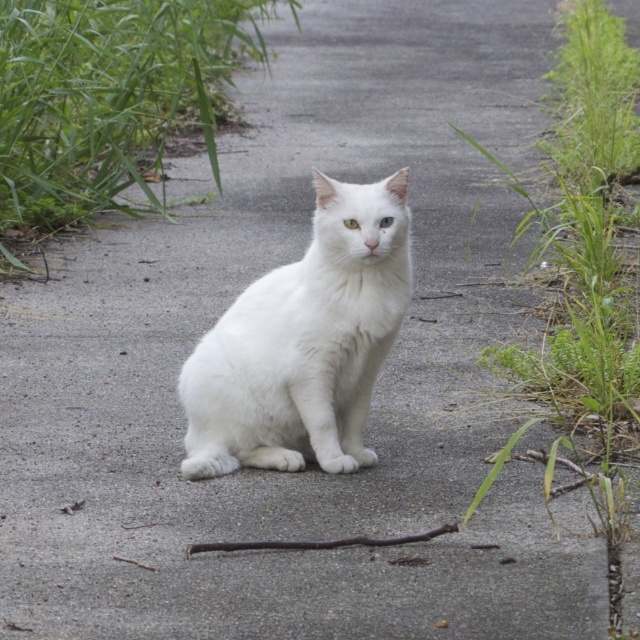
You are a photographer aiming to capture a clear shot of the white fluffy cat at center without any background distractions. Based on the scene, can you position yourself so that the green leafy grass at upper right is not visible in the background behind the cat?

The green leafy grass at upper right is behind the white fluffy cat at center, so positioning yourself so that the cat blocks the grass from view would hide the grass in the background. This can be achieved by framing the shot so the cat is centered and fills the frame enough to cover the upper right area where the grass is located.

You are standing in the middle of the path and want to walk towards the green leafy grass at upper left and the green leafy grass at upper right. Which direction should you face to head towards the one that is on the left side?

You should face towards the left to head towards the green leafy grass at upper left, since it is positioned to the left of the green leafy grass at upper right.

You are a photographer trying to capture the white fluffy cat at center and the green leafy grass at upper right in the same frame. Based on their sizes, which one would appear smaller in the photo?

Result: The white fluffy cat at center appears smaller in the photo because it has a lesser height compared to the green leafy grass at upper right.